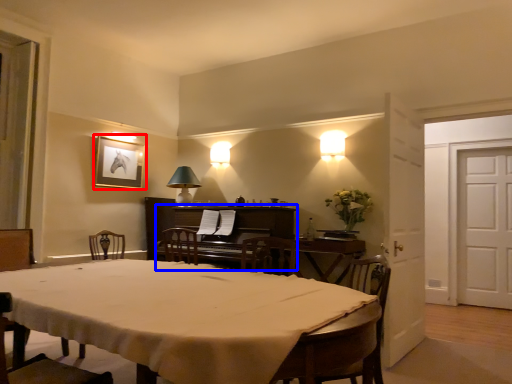
Question: Which point is closer to the camera, picture frame (highlighted by a red box) or piano (highlighted by a blue box)?

Choices:
 (A) picture frame
 (B) piano

Answer: (B)